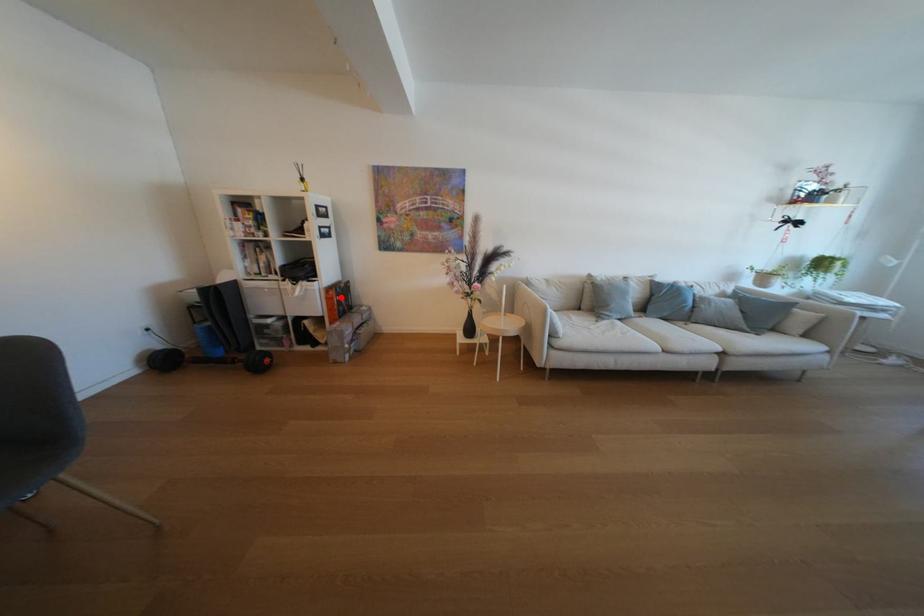
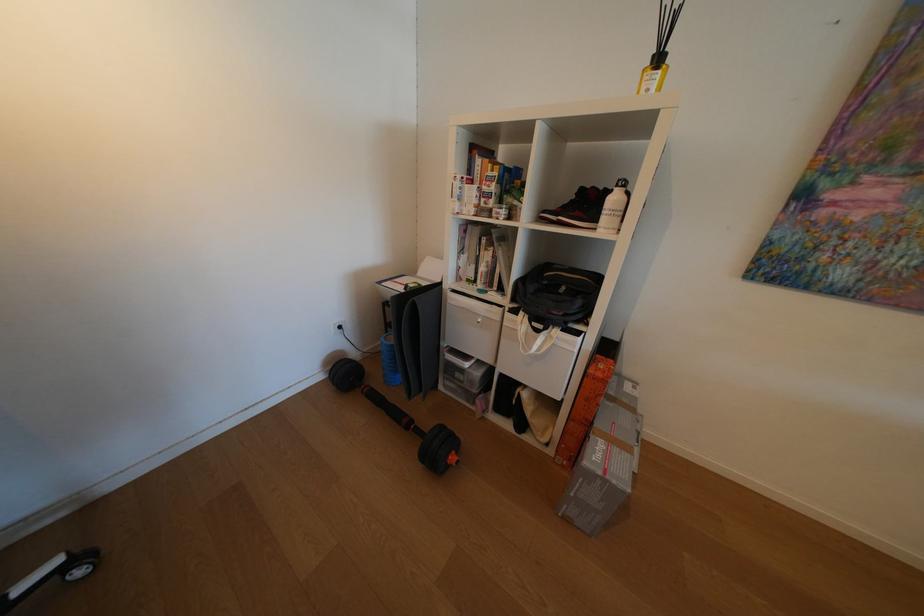
Where in the second image is the point corresponding to the highlighted location from the first image?

(611, 376)